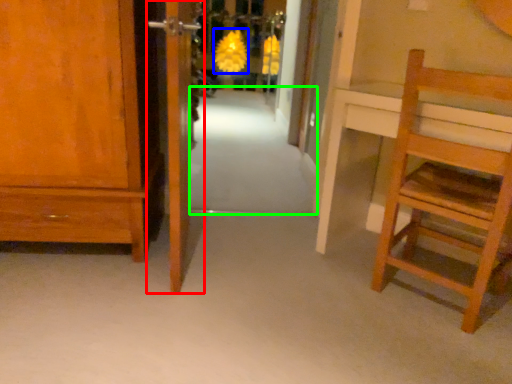
Question: Based on their relative distances, which object is farther from door (highlighted by a red box)? Choose from flower (highlighted by a blue box) and path (highlighted by a green box).

Choices:
 (A) flower
 (B) path

Answer: (A)